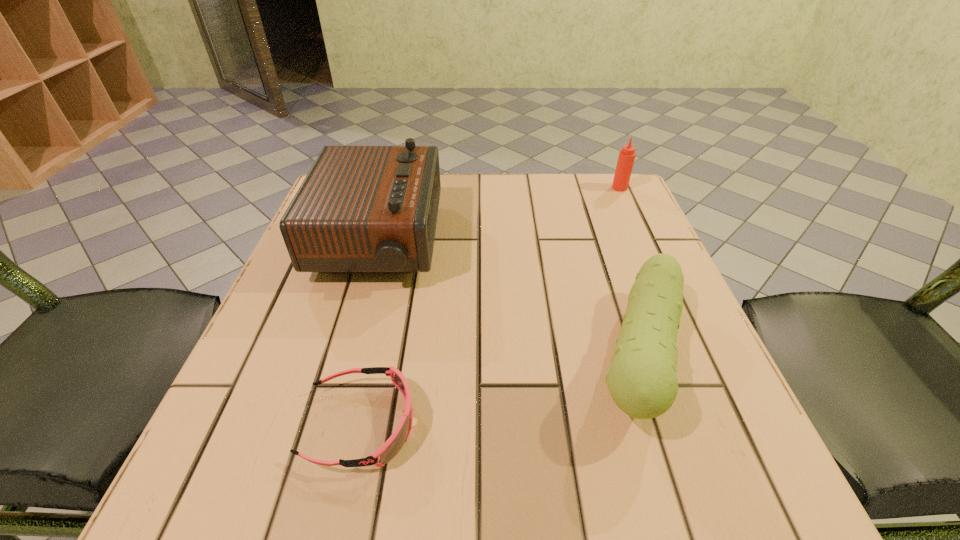
Locate an element on the screen. The height and width of the screenshot is (540, 960). radio receiver is located at coordinates (361, 209).

Locate an element on the screen. This screenshot has width=960, height=540. the farthest object is located at coordinates (626, 158).

Identify the location of cucumber. (642, 380).

Identify the location of goggles. This screenshot has height=540, width=960. (393, 445).

Find the location of `vacant space located 0.150m on the front panel of the tallest object`. vacant space located 0.150m on the front panel of the tallest object is located at coordinates (507, 241).

Where is `vacant area situated on the left of the farthest object`? vacant area situated on the left of the farthest object is located at coordinates (516, 188).

Where is `free spot located 0.160m on the left of the cucumber`? free spot located 0.160m on the left of the cucumber is located at coordinates (487, 356).

Where is `vacant region located on the front-facing side of the goggles`? The image size is (960, 540). vacant region located on the front-facing side of the goggles is located at coordinates (668, 424).

You are a GUI agent. You are given a task and a screenshot of the screen. Output one action in this format:
    pyautogui.click(x=<x>, y=<y>)
    Task: Click on the radio receiver at the far edge
    Image resolution: width=960 pixels, height=540 pixels.
    Given the screenshot: What is the action you would take?
    pyautogui.click(x=361, y=209)

In order to click on Tabasco sauce at the far edge in this screenshot , I will do `click(626, 158)`.